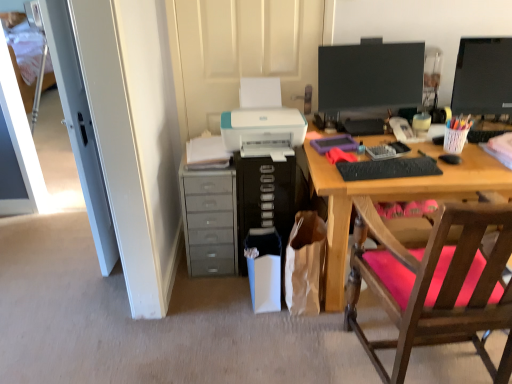
Question: Is point (386, 155) closer or farther from the camera than point (266, 218)?

Choices:
 (A) farther
 (B) closer

Answer: (B)

Question: From the image's perspective, is clear plastic tray at upper right positioned above or below black plastic computer tower at center?

Choices:
 (A) below
 (B) above

Answer: (B)

Question: Which of these objects is positioned farthest from the wooden chair with pink cushion at right?

Choices:
 (A) white glossy door at left
 (B) gray plastic drawers at lower left
 (C) translucent plastic pencil case at center, the first stationery when ordered from top to bottom
 (D) black matte keyboard at center
 (E) white paper bag at lower center

Answer: (A)

Question: Considering the real-world distances, which object is farthest from the clear plastic tray at upper right?

Choices:
 (A) black glossy monitor at upper right, which appears as the 1th computer monitor when viewed from the left
 (B) white fabric bed at left
 (C) black plastic computer tower at center
 (D) gray plastic drawers at lower left
 (E) black plastic mouse at right

Answer: (B)